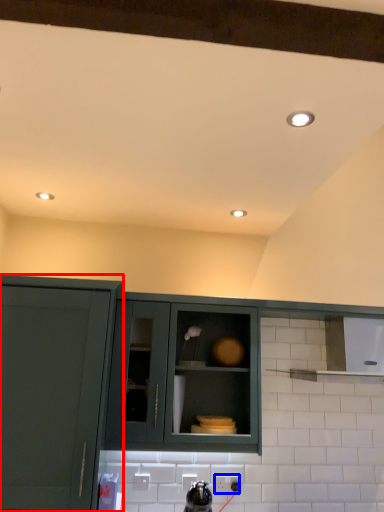
Question: Which object is further to the camera taking this photo, cabinetry (highlighted by a red box) or electric outlet (highlighted by a blue box)?

Choices:
 (A) cabinetry
 (B) electric outlet

Answer: (B)